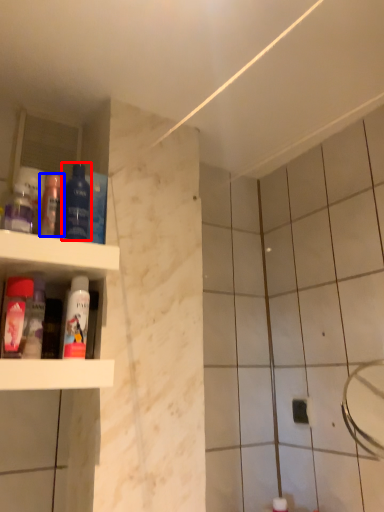
Question: Which of the following is the farthest to the observer, mouthwash (highlighted by a red box) or mouthwash (highlighted by a blue box)?

Choices:
 (A) mouthwash
 (B) mouthwash

Answer: (B)